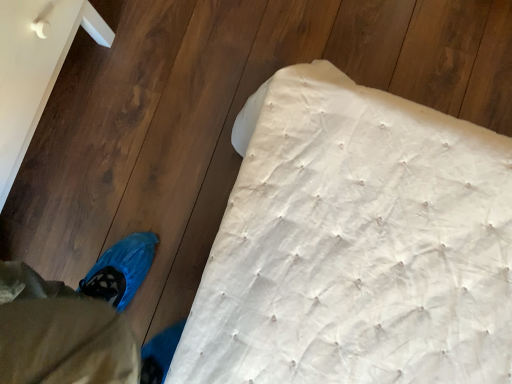
Locate an element on the screen. Image resolution: width=512 pixels, height=384 pixels. vacant space underneath blue fabric bag at lower left (from a real-world perspective) is located at coordinates (54, 155).